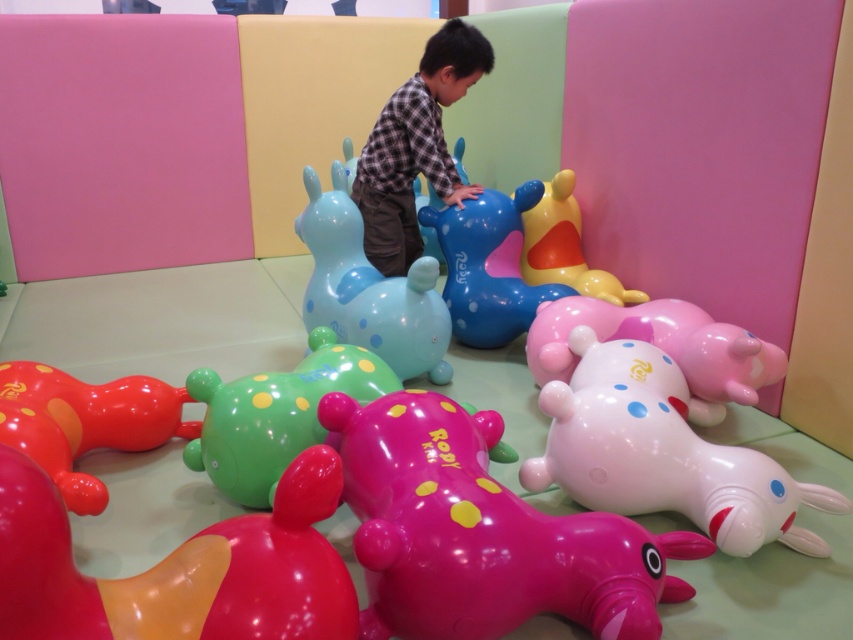
Question: Which point is farther to the camera?

Choices:
 (A) pink glossy dog at center
 (B) green rubber dog at center
 (C) rubber duck at upper right
 (D) matte plaid shirt at center

Answer: (D)

Question: Which of the following is the farthest from the observer?

Choices:
 (A) (416, 252)
 (B) (564, 468)

Answer: (A)

Question: Based on their relative distances, which object is farther from the rubber duck at lower left?

Choices:
 (A) rubber duck at upper right
 (B) green rubber dog at center
 (C) matte plaid shirt at center

Answer: (A)

Question: Where is pink glossy dog at center located in relation to rubber duck at upper right in the image?

Choices:
 (A) below
 (B) above

Answer: (A)

Question: Is matte blue rubber dog at center behind rubber duck at lower left?

Choices:
 (A) no
 (B) yes

Answer: (B)

Question: From the image, what is the correct spatial relationship of pink glossy dog at center in relation to rubber duck at upper right?

Choices:
 (A) right
 (B) left

Answer: (B)